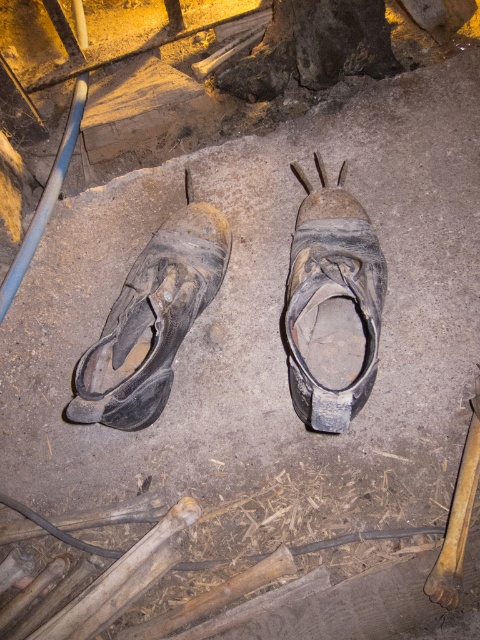
You are standing in a workshop and see the worn leather sandal at center and the worn leather shoe at left. Which one is positioned more to the left side?

The worn leather shoe at left is positioned more to the left side than the worn leather sandal at center.

You are a delivery person who needs to place a small package between the worn leather sandal at center and the worn leather shoe at left. Can you fit it there?

The distance between the worn leather sandal at center and the worn leather shoe at left is 12.38 inches. Since the package is small, it should fit comfortably in that space.

Looking at this image, you are trying to decide which of the worn leather sandal at center and worn leather shoe at left can fit into a narrow storage compartment. Based on their widths, which one is more likely to fit?

The worn leather sandal at center has a smaller width than the worn leather shoe at left, so it is more likely to fit into the narrow storage compartment.